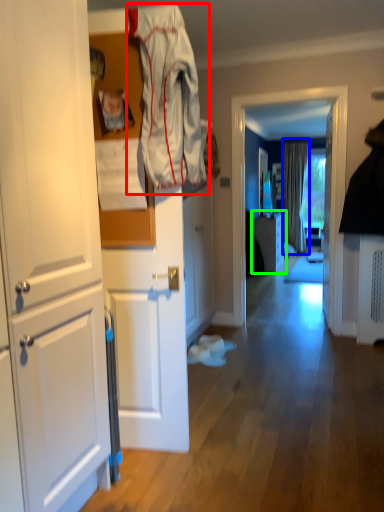
Question: Which object is the closest to the clothing (highlighted by a red box)? Choose among these: curtain (highlighted by a blue box) or cabinetry (highlighted by a green box).

Choices:
 (A) curtain
 (B) cabinetry

Answer: (B)